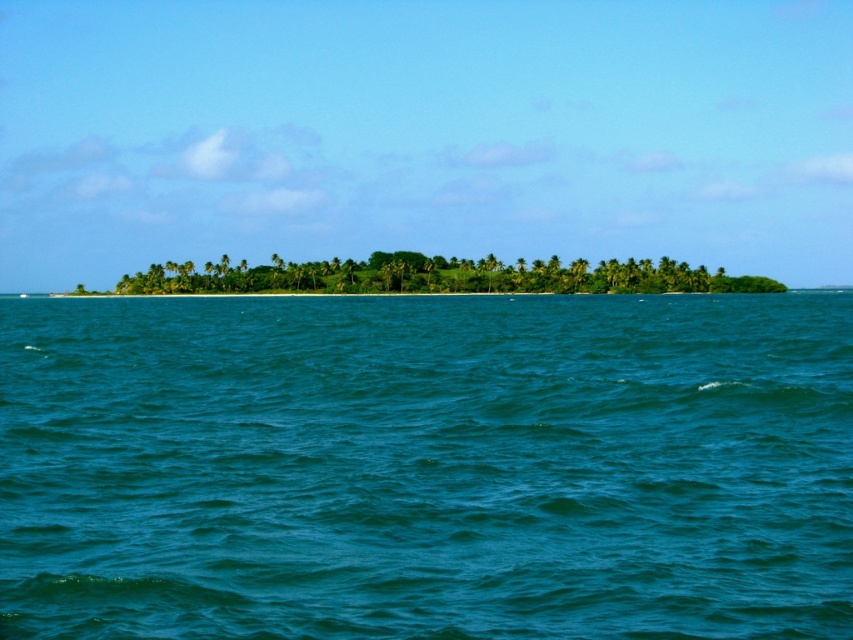
Question: Which point is closer to the camera?

Choices:
 (A) (0, 600)
 (B) (572, 266)

Answer: (A)

Question: Does teal glossy water at center lie in front of green leafy island at center?

Choices:
 (A) yes
 (B) no

Answer: (A)

Question: Which point appears closest to the camera in this image?

Choices:
 (A) (738, 288)
 (B) (581, 348)

Answer: (B)

Question: From the image, what is the correct spatial relationship of teal glossy water at center in relation to green leafy island at center?

Choices:
 (A) below
 (B) above

Answer: (A)

Question: Is teal glossy water at center further to camera compared to green leafy island at center?

Choices:
 (A) yes
 (B) no

Answer: (B)